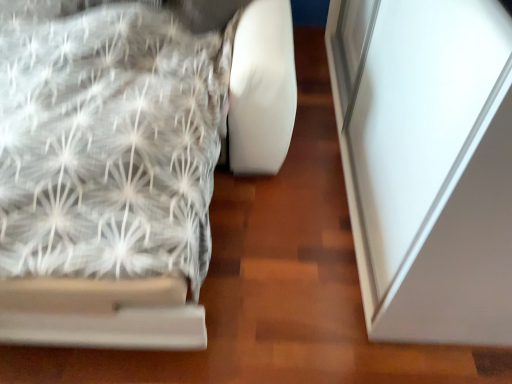
Describe the element at coordinates (106, 174) in the screenshot. I see `white glossy cabinet at right` at that location.

At what (x,y) coordinates should I click in order to perform the action: click on white glossy cabinet at right. Please return your answer as a coordinate pair (x, y). The image size is (512, 384). Looking at the image, I should click on (106, 174).

You are a GUI agent. You are given a task and a screenshot of the screen. Output one action in this format:
    pyautogui.click(x=<x>, y=<y>)
    Task: Click on the white glossy cabinet at right
    The width and height of the screenshot is (512, 384).
    Given the screenshot: What is the action you would take?
    pyautogui.click(x=106, y=174)